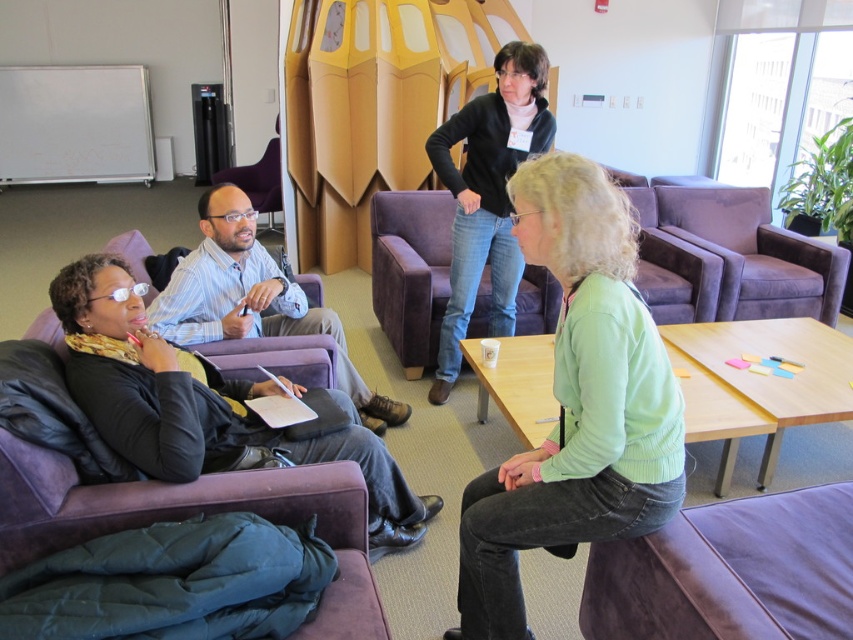
Between green knitwear at center and purple suede couch at lower right, which one is positioned lower?

purple suede couch at lower right is below.

At what (x,y) coordinates should I click in order to perform the action: click on green knitwear at center. Please return your answer as a coordinate pair (x, y). Looking at the image, I should click on (576, 403).

Which is in front, point (476, 499) or point (718, 620)?

Point (718, 620)

Where is `green knitwear at center`? green knitwear at center is located at coordinates (576, 403).

Is green knitwear at center below matte purple armchair at center?

Correct, green knitwear at center is located below matte purple armchair at center.

Can you confirm if green knitwear at center is positioned above matte purple armchair at center?

Incorrect, green knitwear at center is not positioned above matte purple armchair at center.

Does point (675, 404) lie behind point (268, 176)?

No, it is in front of (268, 176).

The width and height of the screenshot is (853, 640). I want to click on green knitwear at center, so click(x=576, y=403).

Can you confirm if matte black shirt at center is bigger than matte purple armchair at center?

Correct, matte black shirt at center is larger in size than matte purple armchair at center.

Does matte black shirt at center have a lesser height compared to matte purple armchair at center?

No.

Between point (161, 314) and point (277, 116), which one is positioned behind?

The point (277, 116) is more distant.

Where is `matte black shirt at center`? matte black shirt at center is located at coordinates [252, 300].